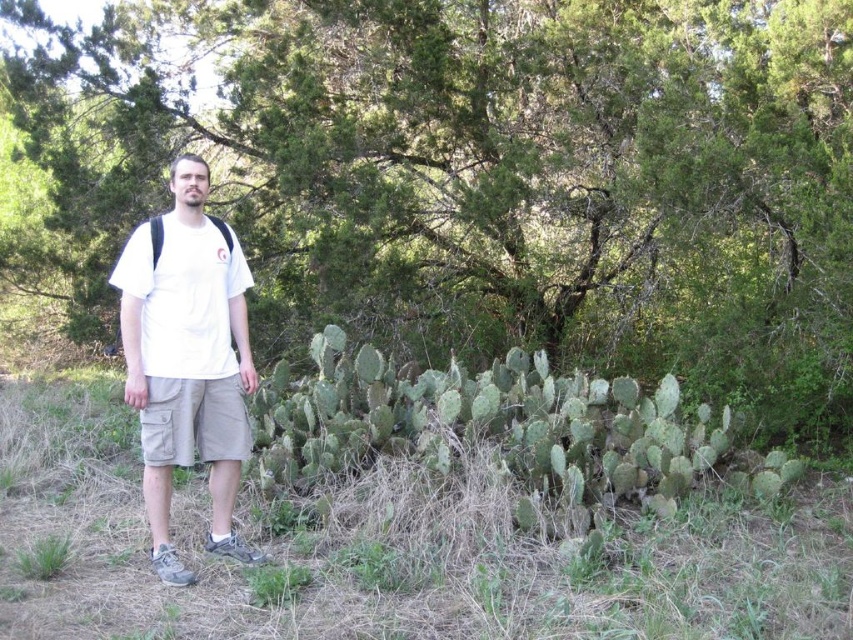
I want to click on green leafy bush at center, so click(491, 173).

Who is shorter, green leafy bush at center or white cotton t-shirt at center?

Standing shorter between the two is white cotton t-shirt at center.

Does point (467, 321) lie in front of point (154, 300)?

That is False.

Locate an element on the screen. green leafy bush at center is located at coordinates (491, 173).